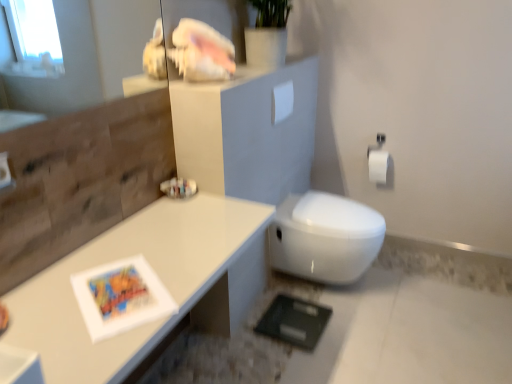
The height and width of the screenshot is (384, 512). I want to click on vacant point above white glossy table at upper left (from a real-world perspective), so click(x=91, y=297).